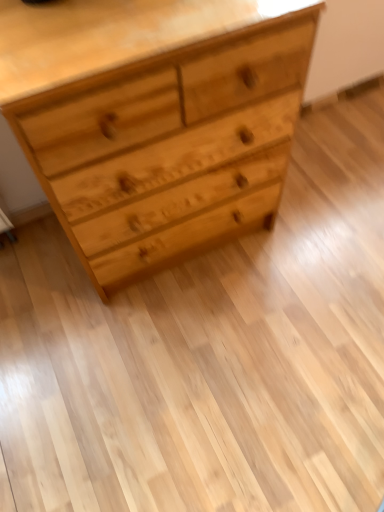
What is the approximate width of natural wood drawer at center?

1.78 inches.

Describe the element at coordinates (176, 157) in the screenshot. This screenshot has width=384, height=512. I see `natural wood drawer at center` at that location.

This screenshot has width=384, height=512. Find the location of `natural wood drawer at center`. natural wood drawer at center is located at coordinates (176, 157).

Where is `natural wood chest of drawers at upper center`? Image resolution: width=384 pixels, height=512 pixels. natural wood chest of drawers at upper center is located at coordinates (155, 118).

What do you see at coordinates (155, 118) in the screenshot? Image resolution: width=384 pixels, height=512 pixels. I see `natural wood chest of drawers at upper center` at bounding box center [155, 118].

Image resolution: width=384 pixels, height=512 pixels. Find the location of `natural wood drawer at center`. natural wood drawer at center is located at coordinates (176, 157).

Can you confirm if natural wood drawer at center is positioned to the right of natural wood chest of drawers at upper center?

Indeed, natural wood drawer at center is positioned on the right side of natural wood chest of drawers at upper center.

Between natural wood drawer at center and natural wood chest of drawers at upper center, which one is positioned in front?

natural wood chest of drawers at upper center is more forward.

Considering the points (202, 162) and (270, 204), which point is behind, point (202, 162) or point (270, 204)?

Point (270, 204)

From the image's perspective, relative to natural wood chest of drawers at upper center, is natural wood drawer at center above or below?

Clearly, from the image's perspective, natural wood drawer at center is above natural wood chest of drawers at upper center.

From a real-world perspective, between natural wood drawer at center and natural wood chest of drawers at upper center, who is vertically lower?

natural wood drawer at center, from a real-world perspective.

Is natural wood drawer at center wider than natural wood chest of drawers at upper center?

No, natural wood drawer at center is not wider than natural wood chest of drawers at upper center.

Which of these two, natural wood drawer at center or natural wood chest of drawers at upper center, stands taller?

With more height is natural wood chest of drawers at upper center.

Considering the relative sizes of natural wood drawer at center and natural wood chest of drawers at upper center in the image provided, is natural wood drawer at center smaller than natural wood chest of drawers at upper center?

Yes.

Can natural wood chest of drawers at upper center be found inside natural wood drawer at center?

That's incorrect, natural wood chest of drawers at upper center is not inside natural wood drawer at center.

Is natural wood drawer at center far from natural wood chest of drawers at upper center?

They are positioned close to each other.

Is natural wood drawer at center facing away from natural wood chest of drawers at upper center?

Correct, natural wood drawer at center is looking away from natural wood chest of drawers at upper center.

Can you tell me how much natural wood drawer at center and natural wood chest of drawers at upper center differ in facing direction?

0.508 degrees separate the facing orientations of natural wood drawer at center and natural wood chest of drawers at upper center.

Find the location of a particular element. the chest of drawers that appears above the natural wood drawer at center (from a real-world perspective) is located at coordinates (155, 118).

Is natural wood chest of drawers at upper center at the left side of natural wood drawer at center?

Indeed, natural wood chest of drawers at upper center is positioned on the left side of natural wood drawer at center.

Is natural wood chest of drawers at upper center further to the viewer compared to natural wood drawer at center?

No, it is in front of natural wood drawer at center.

Does point (123, 259) lie behind point (243, 154)?

That is True.

From the image's perspective, which is above, natural wood chest of drawers at upper center or natural wood drawer at center?

natural wood drawer at center, from the image's perspective.

Consider the image. From a real-world perspective, which is physically above, natural wood chest of drawers at upper center or natural wood drawer at center?

natural wood chest of drawers at upper center is physically above.

Which object is thinner, natural wood chest of drawers at upper center or natural wood drawer at center?

natural wood drawer at center is thinner.

Who is shorter, natural wood chest of drawers at upper center or natural wood drawer at center?

With less height is natural wood drawer at center.

Who is smaller, natural wood chest of drawers at upper center or natural wood drawer at center?

natural wood drawer at center is smaller.

Choose the correct answer: Is natural wood chest of drawers at upper center inside natural wood drawer at center or outside it?

natural wood chest of drawers at upper center is located beyond the bounds of natural wood drawer at center.

Can you see natural wood chest of drawers at upper center touching natural wood drawer at center?

Absolutely, natural wood chest of drawers at upper center is next to and touching natural wood drawer at center.

Is natural wood chest of drawers at upper center facing away from natural wood drawer at center?

Absolutely, natural wood chest of drawers at upper center is directed away from natural wood drawer at center.

Locate an element on the screen. This screenshot has width=384, height=512. drawer that is above the natural wood chest of drawers at upper center (from the image's perspective) is located at coordinates (176, 157).

Image resolution: width=384 pixels, height=512 pixels. I want to click on the chest of drawers that is below the natural wood drawer at center (from the image's perspective), so click(155, 118).

You are a GUI agent. You are given a task and a screenshot of the screen. Output one action in this format:
    pyautogui.click(x=<x>, y=<y>)
    Task: Click on the drawer on the right of natural wood chest of drawers at upper center
    Image resolution: width=384 pixels, height=512 pixels.
    Given the screenshot: What is the action you would take?
    pyautogui.click(x=176, y=157)